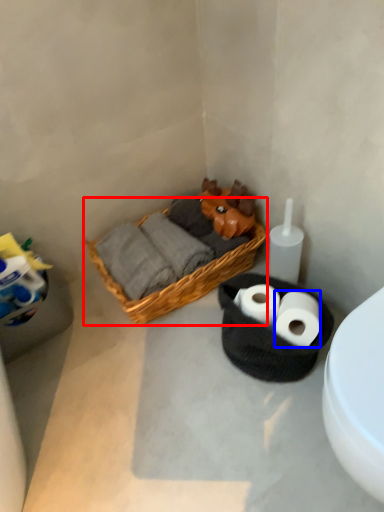
Question: Which point is closer to the camera, picnic basket (highlighted by a red box) or toilet paper (highlighted by a blue box)?

Choices:
 (A) picnic basket
 (B) toilet paper

Answer: (B)